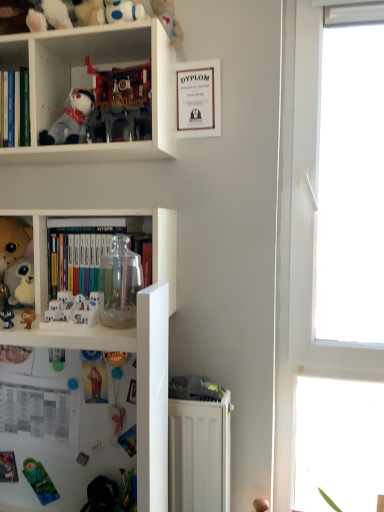
Question: Considering their positions, is transparent glass jar at center, acting as the first book starting from the bottom, located in front of or behind white plush toy at upper left, which is the 7th toy from bottom to top?

Choices:
 (A) front
 (B) behind

Answer: (B)

Question: In the image, is transparent glass jar at center, arranged as the 2th book when viewed from the top, on the left side or the right side of white plush toy at upper left, which is the 7th toy from bottom to top?

Choices:
 (A) left
 (B) right

Answer: (B)

Question: Estimate the real-world distances between objects in this image. Which object is farther from the white plush toy at upper left, which is the 7th toy from bottom to top?

Choices:
 (A) transparent glass jar at center, placed as the 1th book when sorted from right to left
 (B) pink fabric toy at lower center, arranged as the second toy when ordered from the bottom
 (C) white plastic toy at lower left, the fifth toy from the bottom
 (D) transparent glass jar at center
 (E) white plastic bookcase at center, marked as the second bookcase in a top-to-bottom arrangement

Answer: (B)

Question: Estimate the real-world distances between objects in this image. Which object is farther from the translucent plastic toy at lower left, the 8th toy in the top-to-bottom sequence?

Choices:
 (A) pink fabric toy at lower center, arranged as the second toy when ordered from the bottom
 (B) white plastic bookshelf at upper left, which is counted as the second bookcase, starting from the bottom
 (C) matte plastic monkey at lower left, which is the 6th toy from top to bottom
 (D) white plastic toy at lower left, arranged as the fourth toy when viewed from the top
 (E) white plastic bookcase at center, marked as the second bookcase in a top-to-bottom arrangement

Answer: (B)